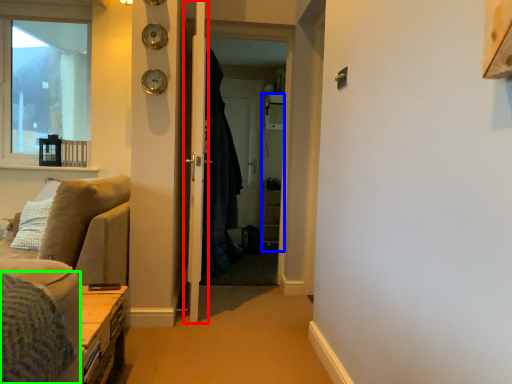
Question: Which object is positioned closest to door (highlighted by a red box)? Select from cabinetry (highlighted by a blue box) and bedding (highlighted by a green box).

Choices:
 (A) cabinetry
 (B) bedding

Answer: (B)